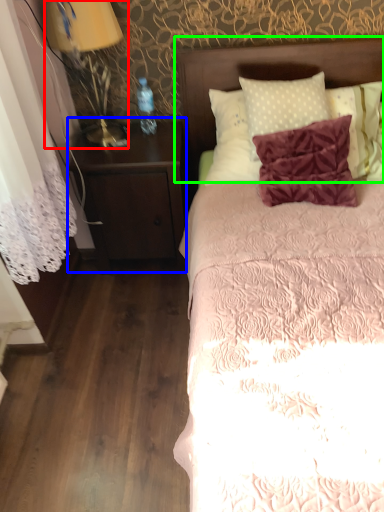
Question: Estimate the real-world distances between objects in this image. Which object is farther from bedside lamp (highlighted by a red box), nightstand (highlighted by a blue box) or headboard (highlighted by a green box)?

Choices:
 (A) nightstand
 (B) headboard

Answer: (B)